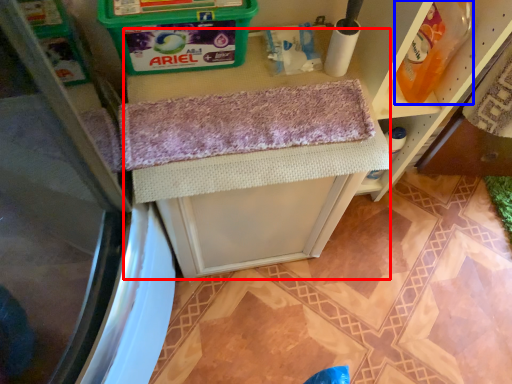
Question: Which of the following is the closest to the observer, vanity (highlighted by a red box) or cleaning product (highlighted by a blue box)?

Choices:
 (A) vanity
 (B) cleaning product

Answer: (B)